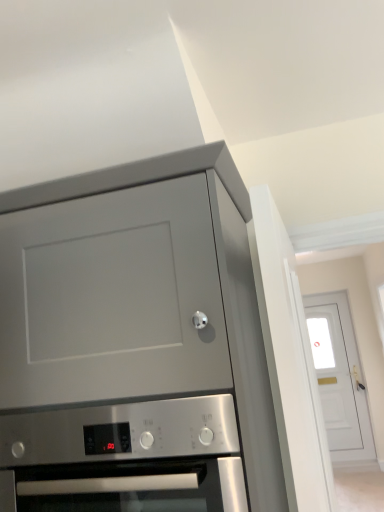
What do you see at coordinates (339, 377) in the screenshot? I see `white glossy door at upper right` at bounding box center [339, 377].

In order to face stainless steel oven at lower center, should I rotate leftwards or rightwards?

To face it directly, rotate left by 4.603 degrees.

What is the approximate width of matte gray cabinet at upper left?

25.30 inches.

Consider the image. In order to face matte gray cabinet at upper left, should I rotate leftwards or rightwards?

Turn left by 11.577 degrees to look at matte gray cabinet at upper left.

Where is `white glossy door at upper right`? The width and height of the screenshot is (384, 512). white glossy door at upper right is located at coordinates (339, 377).

What's the angular difference between matte gray cabinet at upper left and white glossy door at upper right's facing directions?

1.86 degrees separate the facing orientations of matte gray cabinet at upper left and white glossy door at upper right.

From the picture: Is matte gray cabinet at upper left positioned with its back to white glossy door at upper right?

Correct, matte gray cabinet at upper left is looking away from white glossy door at upper right.

Is matte gray cabinet at upper left situated inside white glossy door at upper right or outside?

matte gray cabinet at upper left lies outside white glossy door at upper right.

Can you confirm if white glossy door at upper right is bigger than matte gray cabinet at upper left?

No.

From the image's perspective, would you say white glossy door at upper right is shown under matte gray cabinet at upper left?

Yes, from the image's perspective, white glossy door at upper right is below matte gray cabinet at upper left.

Is the position of white glossy door at upper right less distant than that of matte gray cabinet at upper left?

No, it is behind matte gray cabinet at upper left.

Considering the relative sizes of white glossy door at upper right and stainless steel oven at lower center in the image provided, is white glossy door at upper right smaller than stainless steel oven at lower center?

Yes.

Is there a large distance between white glossy door at upper right and stainless steel oven at lower center?

Indeed, white glossy door at upper right is not near stainless steel oven at lower center.

From the picture: From the image's perspective, is white glossy door at upper right located above or below stainless steel oven at lower center?

Based on their image positions, white glossy door at upper right is located beneath stainless steel oven at lower center.

Which is more to the right, matte gray cabinet at upper left or stainless steel oven at lower center?

stainless steel oven at lower center is more to the right.

Who is more distant, matte gray cabinet at upper left or stainless steel oven at lower center?

stainless steel oven at lower center is more distant.

Which object is thinner, matte gray cabinet at upper left or stainless steel oven at lower center?

With smaller width is stainless steel oven at lower center.

Is point (172, 182) farther from viewer compared to point (23, 429)?

No, it is not.

In the scene shown: From the image's perspective, which one is positioned lower, stainless steel oven at lower center or white glossy door at upper right?

From the image's view, white glossy door at upper right is below.

Between stainless steel oven at lower center and white glossy door at upper right, which one has smaller size?

Smaller between the two is white glossy door at upper right.

Considering the positions of objects stainless steel oven at lower center and white glossy door at upper right in the image provided, who is more to the left, stainless steel oven at lower center or white glossy door at upper right?

Positioned to the left is stainless steel oven at lower center.

Locate an element on the screen. This screenshot has width=384, height=512. door below the stainless steel oven at lower center (from the image's perspective) is located at coordinates (339, 377).

Where is `oven behind the matte gray cabinet at upper left`? The height and width of the screenshot is (512, 384). oven behind the matte gray cabinet at upper left is located at coordinates (124, 457).

Is stainless steel oven at lower center situated inside matte gray cabinet at upper left or outside?

stainless steel oven at lower center is located inside matte gray cabinet at upper left.

From the image's perspective, is stainless steel oven at lower center located above or below matte gray cabinet at upper left?

From the image's perspective, stainless steel oven at lower center appears below matte gray cabinet at upper left.

From a real-world perspective, between stainless steel oven at lower center and matte gray cabinet at upper left, who is vertically lower?

stainless steel oven at lower center, from a real-world perspective.

There is a white glossy door at upper right. At what (x,y) coordinates should I click in order to perform the action: click on cabinetry above it (from a real-world perspective). Please return your answer as a coordinate pair (x, y). Looking at the image, I should click on (134, 344).

Find the location of `door behind the matte gray cabinet at upper left`. door behind the matte gray cabinet at upper left is located at coordinates click(x=339, y=377).

When comparing their distances from stainless steel oven at lower center, does matte gray cabinet at upper left or white glossy door at upper right seem further?

white glossy door at upper right.

Considering their positions, is white glossy door at upper right positioned further to stainless steel oven at lower center than matte gray cabinet at upper left?

Based on the image, white glossy door at upper right appears to be further to stainless steel oven at lower center.

When comparing their distances from white glossy door at upper right, does stainless steel oven at lower center or matte gray cabinet at upper left seem further?

stainless steel oven at lower center is positioned further to the anchor white glossy door at upper right.

From the image, which object appears to be farther from matte gray cabinet at upper left, stainless steel oven at lower center or white glossy door at upper right?

white glossy door at upper right lies further to matte gray cabinet at upper left than the other object.

Which object lies further to the anchor point white glossy door at upper right, matte gray cabinet at upper left or stainless steel oven at lower center?

stainless steel oven at lower center is further to white glossy door at upper right.

Estimate the real-world distances between objects in this image. Which object is closer to matte gray cabinet at upper left, white glossy door at upper right or stainless steel oven at lower center?

stainless steel oven at lower center lies closer to matte gray cabinet at upper left than the other object.

Locate an element on the screen. This screenshot has height=512, width=384. oven positioned between matte gray cabinet at upper left and white glossy door at upper right from near to far is located at coordinates (124, 457).